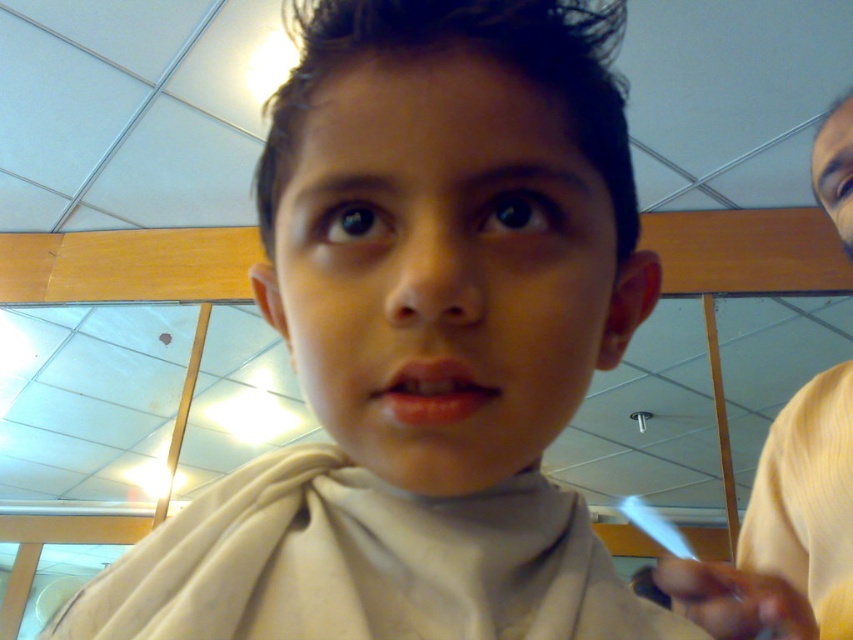
Does point (836, 156) lie behind point (467, 362)?

That is True.

Who is positioned more to the right, yellow fabric shirt at right or smooth pink lips at center?

From the viewer's perspective, yellow fabric shirt at right appears more on the right side.

Is point (843, 200) in front of point (387, 385)?

No, (843, 200) is behind (387, 385).

You are a GUI agent. You are given a task and a screenshot of the screen. Output one action in this format:
    pyautogui.click(x=<x>, y=<y>)
    Task: Click on the yellow fabric shirt at right
    The height and width of the screenshot is (640, 853).
    Given the screenshot: What is the action you would take?
    pyautogui.click(x=804, y=513)